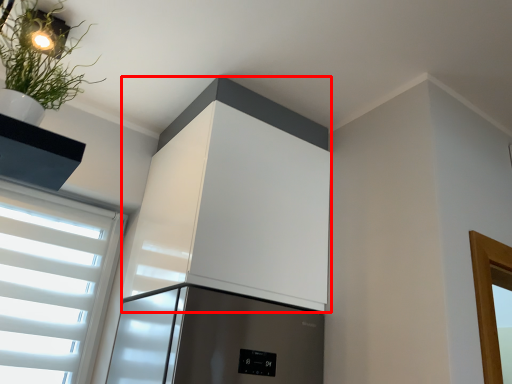
Question: In this image, where is appliance (annotated by the red box) located relative to houseplant?

Choices:
 (A) left
 (B) right

Answer: (B)